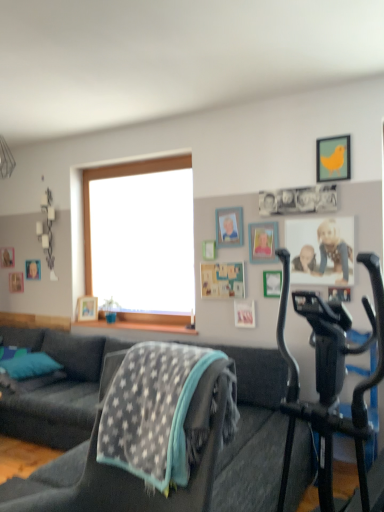
Question: Which direction should I rotate to look at dark gray fabric couch at center, the first studio couch positioned from the right?

Choices:
 (A) right
 (B) left

Answer: (A)

Question: Is wooden picture frame at lower left, which ranks as the 3th picture frame in left-to-right order, not close to teal fabric pillow at lower left?

Choices:
 (A) yes
 (B) no

Answer: (B)

Question: Can you confirm if wooden picture frame at lower left, which ranks as the 3th picture frame in left-to-right order, is thinner than teal fabric pillow at lower left?

Choices:
 (A) no
 (B) yes

Answer: (B)

Question: Can you confirm if wooden picture frame at lower left, marked as the 6th picture frame in a right-to-left arrangement, is shorter than teal fabric pillow at lower left?

Choices:
 (A) yes
 (B) no

Answer: (B)

Question: Is wooden picture frame at lower left, which is the 6th picture frame from front to back, to the left of teal fabric pillow at lower left from the viewer's perspective?

Choices:
 (A) no
 (B) yes

Answer: (A)

Question: From a real-world perspective, is wooden picture frame at lower left, which is the 6th picture frame from front to back, beneath teal fabric pillow at lower left?

Choices:
 (A) no
 (B) yes

Answer: (A)

Question: Can you confirm if wooden picture frame at lower left, marked as the 6th picture frame in a right-to-left arrangement, is wider than teal fabric pillow at lower left?

Choices:
 (A) no
 (B) yes

Answer: (A)

Question: Could you tell me if dark gray fabric couch at lower left, the second studio couch from the right, is facing metallic silver picture frame at center, the seventh picture frame from the left?

Choices:
 (A) yes
 (B) no

Answer: (B)

Question: Does dark gray fabric couch at lower left, which ranks as the 1th studio couch in left-to-right order, have a smaller size compared to metallic silver picture frame at center, the seventh picture frame from the left?

Choices:
 (A) yes
 (B) no

Answer: (B)

Question: Considering the relative sizes of dark gray fabric couch at lower left, the second studio couch from the right, and metallic silver picture frame at center, acting as the 2th picture frame starting from the front, in the image provided, is dark gray fabric couch at lower left, the second studio couch from the right, bigger than metallic silver picture frame at center, acting as the 2th picture frame starting from the front,?

Choices:
 (A) yes
 (B) no

Answer: (A)

Question: From the image's perspective, is dark gray fabric couch at lower left, the second studio couch from the right, on top of metallic silver picture frame at center, placed as the 2th picture frame when sorted from right to left?

Choices:
 (A) no
 (B) yes

Answer: (A)

Question: Does dark gray fabric couch at lower left, which ranks as the 1th studio couch in left-to-right order, contain metallic silver picture frame at center, arranged as the 7th picture frame when viewed from the back?

Choices:
 (A) no
 (B) yes

Answer: (A)

Question: Does dark gray fabric couch at lower left, the second studio couch from the right, have a lesser height compared to metallic silver picture frame at center, placed as the 2th picture frame when sorted from right to left?

Choices:
 (A) no
 (B) yes

Answer: (A)

Question: Is wooden picture frame at upper right, the 4th picture frame positioned from the right, not near wooden picture frame at upper center, the 6th picture frame from the left?

Choices:
 (A) yes
 (B) no

Answer: (B)